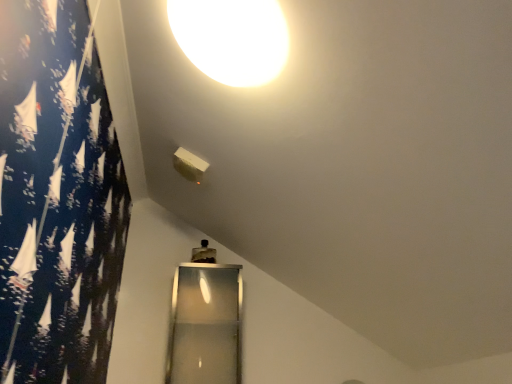
Question: From the image's perspective, is white glossy lampshade at upper center above or below transparent glass door at lower center?

Choices:
 (A) below
 (B) above

Answer: (B)

Question: Considering the positions of white glossy lampshade at upper center and transparent glass door at lower center in the image, is white glossy lampshade at upper center taller or shorter than transparent glass door at lower center?

Choices:
 (A) short
 (B) tall

Answer: (A)

Question: Relative to transparent glass door at lower center, is white glossy lampshade at upper center in front or behind?

Choices:
 (A) front
 (B) behind

Answer: (A)

Question: Is transparent glass door at lower center wider or thinner than white glossy lampshade at upper center?

Choices:
 (A) wide
 (B) thin

Answer: (B)

Question: Is transparent glass door at lower center spatially inside white glossy lampshade at upper center, or outside of it?

Choices:
 (A) inside
 (B) outside

Answer: (B)

Question: From the image's perspective, is transparent glass door at lower center above or below white glossy lampshade at upper center?

Choices:
 (A) below
 (B) above

Answer: (A)

Question: Considering the positions of transparent glass door at lower center and white glossy lampshade at upper center in the image, is transparent glass door at lower center bigger or smaller than white glossy lampshade at upper center?

Choices:
 (A) big
 (B) small

Answer: (A)